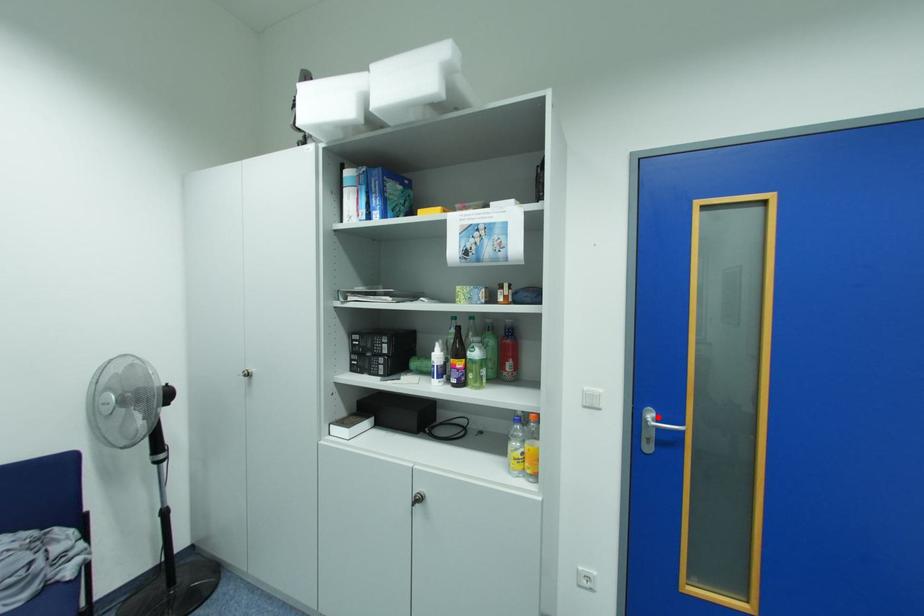
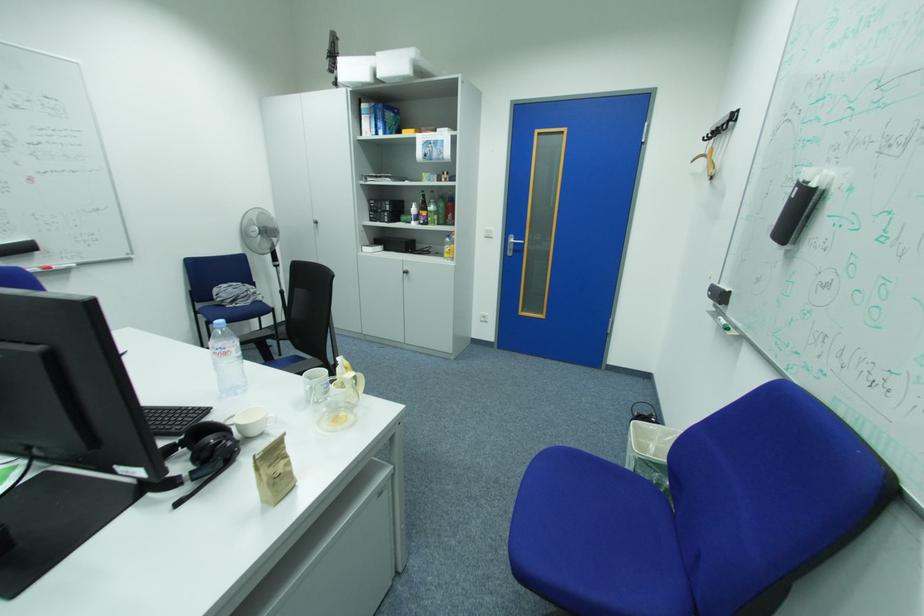
Question: I am providing you with two images of the same scene from different viewpoints. Image1 has a red point marked. In image2, the corresponding 3D location appears at what relative position? Reply with the corresponding letter.

Choices:
 (A) Closer
 (B) Farther

Answer: (A)